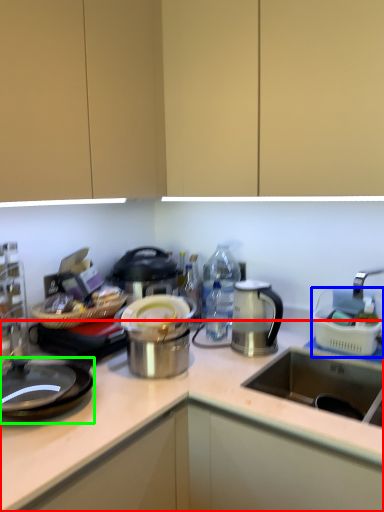
Question: Which object is positioned closest to countertop (highlighted by a red box)? Select from appliance (highlighted by a blue box) and gas stove (highlighted by a green box).

Choices:
 (A) appliance
 (B) gas stove

Answer: (B)